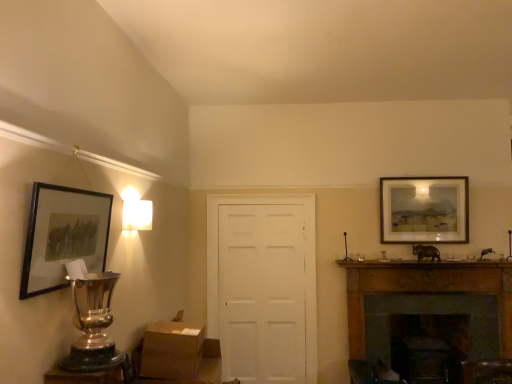
Question: Is brown cardboard box at lower center inside matte wooden picture frame at upper right, which is the 2th picture frame from front to back?

Choices:
 (A) no
 (B) yes

Answer: (A)

Question: Is matte wooden picture frame at upper right, which is the first picture frame in back-to-front order, wider than brown cardboard box at lower center?

Choices:
 (A) yes
 (B) no

Answer: (B)

Question: Is matte wooden picture frame at upper right, acting as the 1th picture frame starting from the right, to the right of brown cardboard box at lower center from the viewer's perspective?

Choices:
 (A) no
 (B) yes

Answer: (B)

Question: Is matte wooden picture frame at upper right, which is the first picture frame in back-to-front order, facing away from brown cardboard box at lower center?

Choices:
 (A) yes
 (B) no

Answer: (B)

Question: From the image's perspective, does matte wooden picture frame at upper right, acting as the 1th picture frame starting from the right, appear lower than brown cardboard box at lower center?

Choices:
 (A) yes
 (B) no

Answer: (B)

Question: Would you say matte wooden picture frame at upper right, which is the 2th picture frame from front to back, is outside brown cardboard box at lower center?

Choices:
 (A) yes
 (B) no

Answer: (A)

Question: From a real-world perspective, is metallic trophy at lower left physically below brown wood fireplace at right?

Choices:
 (A) no
 (B) yes

Answer: (A)

Question: Does metallic trophy at lower left turn towards brown wood fireplace at right?

Choices:
 (A) no
 (B) yes

Answer: (A)

Question: Is metallic trophy at lower left in front of brown wood fireplace at right?

Choices:
 (A) yes
 (B) no

Answer: (A)

Question: Can brown wood fireplace at right be found inside metallic trophy at lower left?

Choices:
 (A) no
 (B) yes

Answer: (A)

Question: Can you confirm if metallic trophy at lower left is smaller than brown wood fireplace at right?

Choices:
 (A) no
 (B) yes

Answer: (B)

Question: From the image's perspective, is metallic trophy at lower left beneath brown wood fireplace at right?

Choices:
 (A) yes
 (B) no

Answer: (B)

Question: Is metallic trophy at lower left oriented towards matte black picture frame at left, arranged as the 1th picture frame when viewed from the front?

Choices:
 (A) no
 (B) yes

Answer: (A)